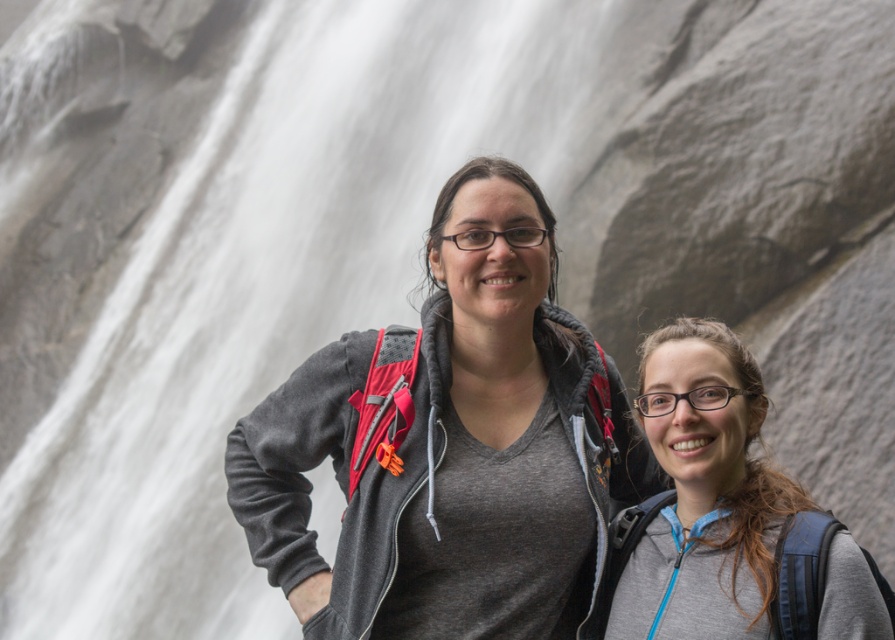
Question: Can you confirm if gray matte jacket at center is wider than gray matte backpack at center?

Choices:
 (A) yes
 (B) no

Answer: (A)

Question: Which point is closer to the camera?

Choices:
 (A) gray matte jacket at center
 (B) gray matte backpack at center

Answer: (B)

Question: Which point appears farthest from the camera in this image?

Choices:
 (A) (721, 499)
 (B) (507, 176)

Answer: (B)

Question: Can you confirm if gray matte jacket at center is positioned above gray matte backpack at center?

Choices:
 (A) yes
 (B) no

Answer: (A)

Question: Does gray matte jacket at center appear over gray matte backpack at center?

Choices:
 (A) no
 (B) yes

Answer: (B)